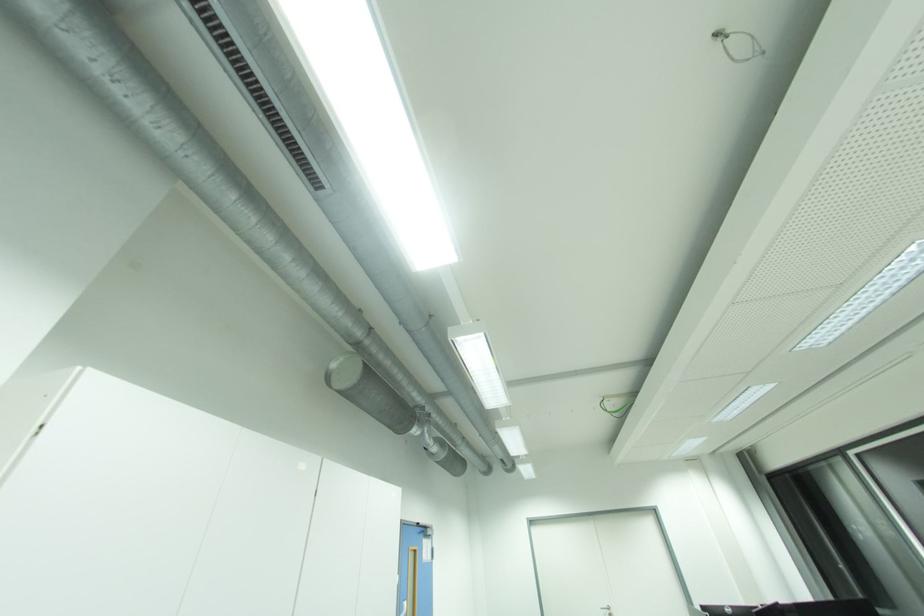
Where would you turn the silver door handle? Please return your answer as a coordinate pair (x, y).

(606, 610)